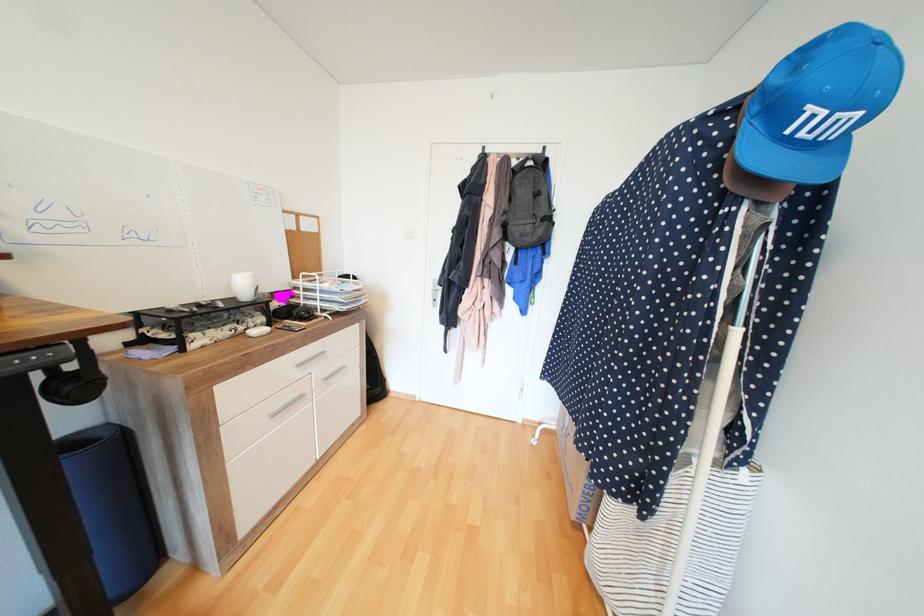
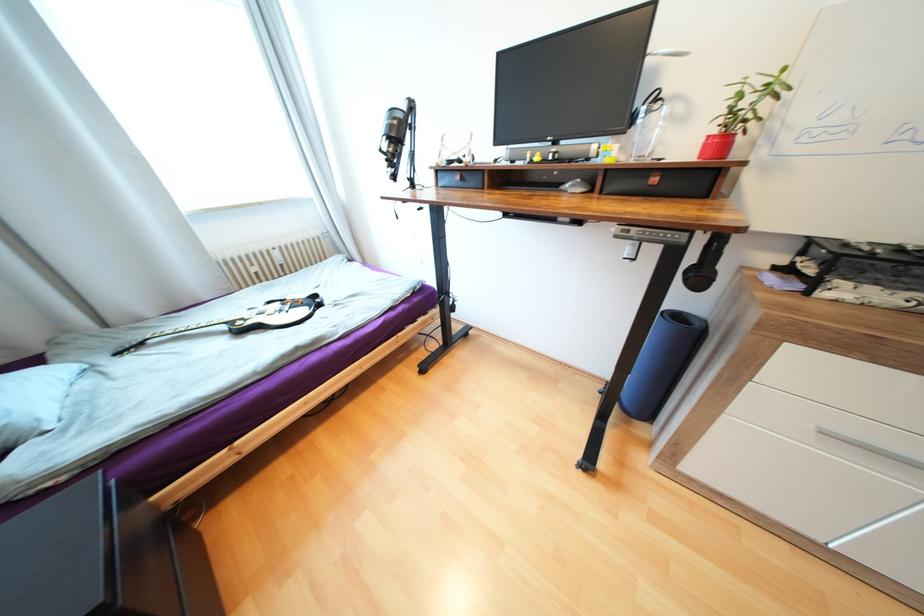
Locate, in the second image, the point that corresponds to (x=280, y=416) in the first image.

(830, 432)